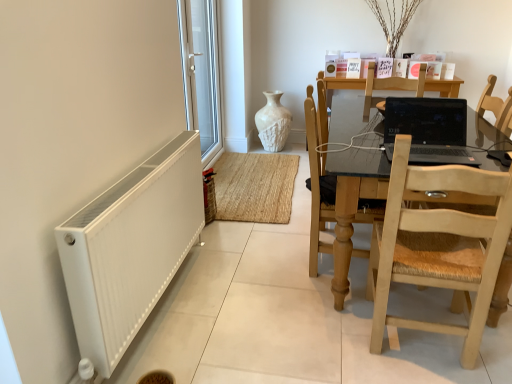
Question: From the image's perspective, is black glossy laptop at center located beneath white textured vase at center?

Choices:
 (A) yes
 (B) no

Answer: (A)

Question: Considering the relative positions of black glossy laptop at center and white textured vase at center in the image provided, is black glossy laptop at center in front of white textured vase at center?

Choices:
 (A) yes
 (B) no

Answer: (A)

Question: Does black glossy laptop at center have a lesser height compared to white textured vase at center?

Choices:
 (A) no
 (B) yes

Answer: (B)

Question: Is black glossy laptop at center with white textured vase at center?

Choices:
 (A) no
 (B) yes

Answer: (A)

Question: Would you consider black glossy laptop at center to be distant from white textured vase at center?

Choices:
 (A) no
 (B) yes

Answer: (B)

Question: From a real-world perspective, is white matte radiator at lower left positioned above or below white plastic window at left?

Choices:
 (A) below
 (B) above

Answer: (A)

Question: From the image's perspective, is white matte radiator at lower left above or below white plastic window at left?

Choices:
 (A) above
 (B) below

Answer: (B)

Question: In terms of width, does white matte radiator at lower left look wider or thinner when compared to white plastic window at left?

Choices:
 (A) thin
 (B) wide

Answer: (A)

Question: Would you say white matte radiator at lower left is to the left or to the right of white plastic window at left in the picture?

Choices:
 (A) left
 (B) right

Answer: (A)

Question: Looking at their shapes, would you say light wood/rattan chair at right, the first chair viewed from the front, is wider or thinner than light wood table at right?

Choices:
 (A) wide
 (B) thin

Answer: (B)

Question: Relative to light wood table at right, is light wood/rattan chair at right, positioned as the 2th chair in back-to-front order, in front or behind?

Choices:
 (A) front
 (B) behind

Answer: (A)

Question: Visually, is light wood/rattan chair at right, the first chair viewed from the front, positioned to the left or to the right of light wood table at right?

Choices:
 (A) left
 (B) right

Answer: (A)

Question: From their relative heights in the image, would you say light wood/rattan chair at right, the first chair viewed from the front, is taller or shorter than light wood table at right?

Choices:
 (A) short
 (B) tall

Answer: (B)

Question: Is light brown wooden chair at center, the first chair from the back, in front of or behind light wood/rattan chair at right, the first chair viewed from the front, in the image?

Choices:
 (A) behind
 (B) front

Answer: (A)

Question: Would you say light brown wooden chair at center, arranged as the 2th chair when viewed from the front, is to the left or to the right of light wood/rattan chair at right, positioned as the 2th chair in back-to-front order, in the picture?

Choices:
 (A) right
 (B) left

Answer: (B)